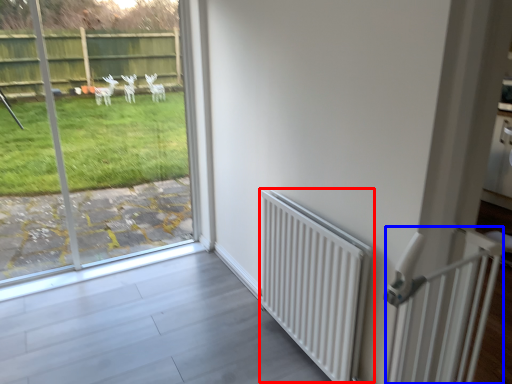
Question: Which point is further to the camera, radiator (highlighted by a red box) or balustrade (highlighted by a blue box)?

Choices:
 (A) radiator
 (B) balustrade

Answer: (A)